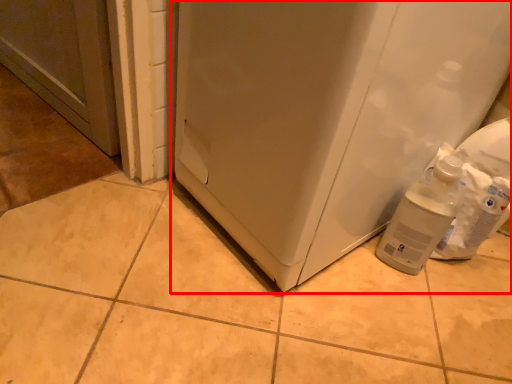
Question: From the image's perspective, where is refrigerator (annotated by the red box) located in relation to bottle in the image?

Choices:
 (A) above
 (B) below

Answer: (A)